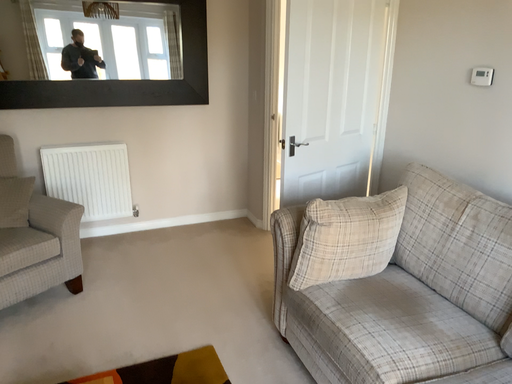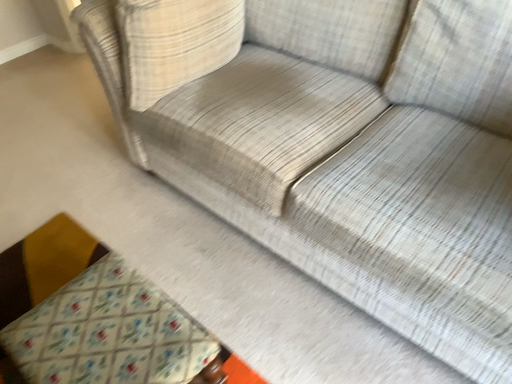
Question: How did the camera likely rotate when shooting the video?

Choices:
 (A) rotated right
 (B) rotated left

Answer: (A)